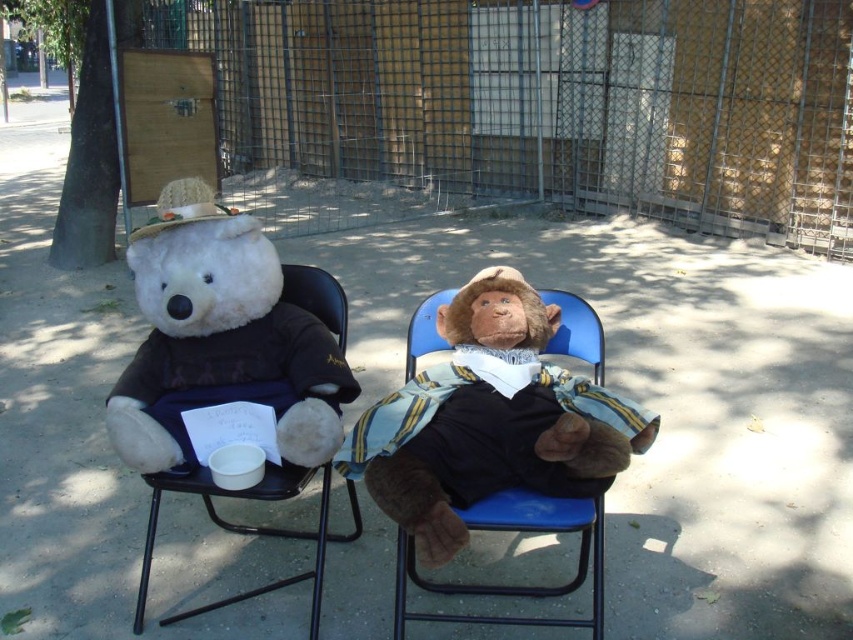
You are standing at the point marked as point [518,531] in the image. Looking around, you see the blue plastic chair at center. What object is located exactly at your current position?

The blue plastic chair at center is located exactly at point [518,531].